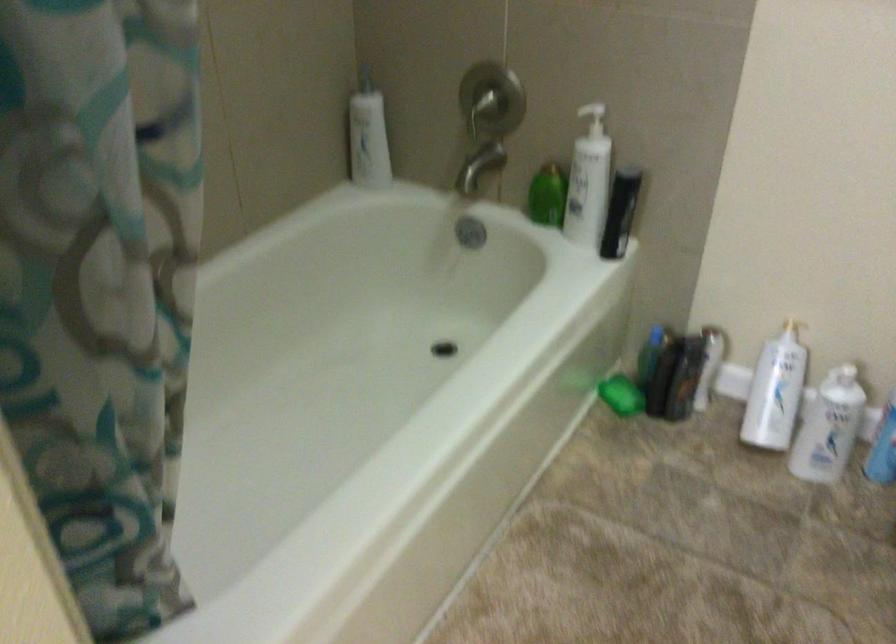
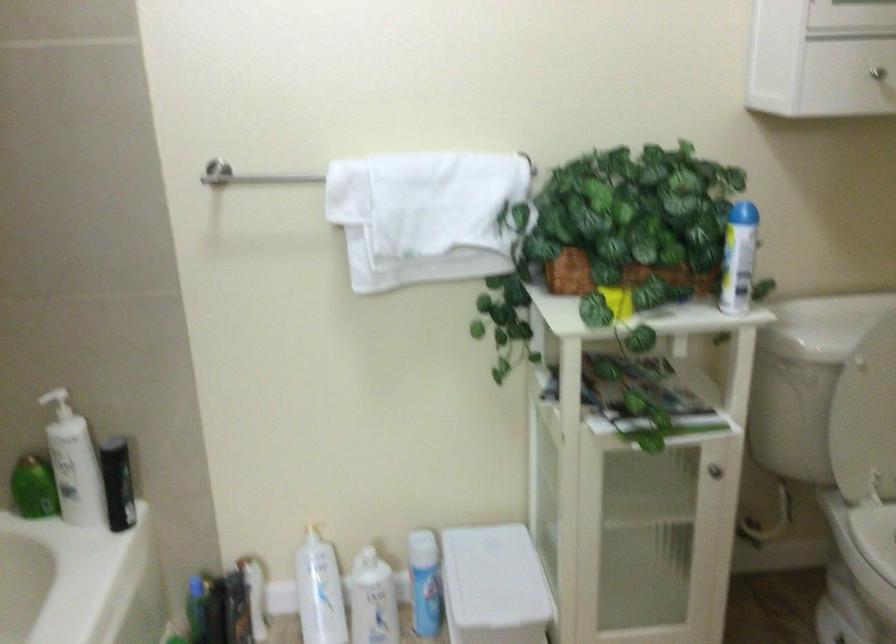
Where in the second image is the point corresponding to (785,317) from the first image?

(306, 523)